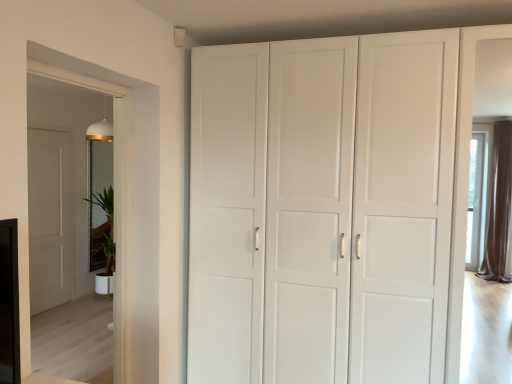
Question: From a real-world perspective, is white glossy plant at left positioned above or below transparent glass door at left?

Choices:
 (A) above
 (B) below

Answer: (B)

Question: From the image's perspective, is white glossy plant at left above or below transparent glass door at left?

Choices:
 (A) below
 (B) above

Answer: (A)

Question: Which object is the farthest from the transparent glass door at left?

Choices:
 (A) white glossy plant at left
 (B) white matte cabinet at center

Answer: (A)

Question: Which object is the closest to the white glossy plant at left?

Choices:
 (A) transparent glass door at left
 (B) white matte cabinet at center

Answer: (A)